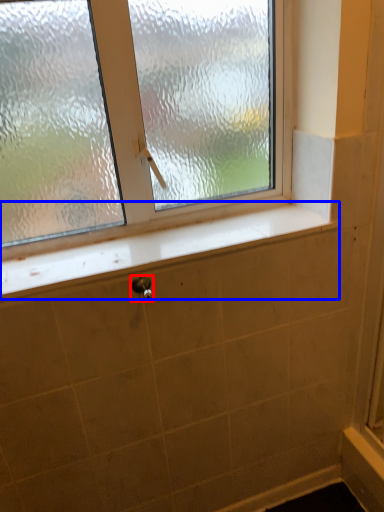
Question: Among these objects, which one is farthest to the camera, shower (highlighted by a red box) or window sill (highlighted by a blue box)?

Choices:
 (A) shower
 (B) window sill

Answer: (A)